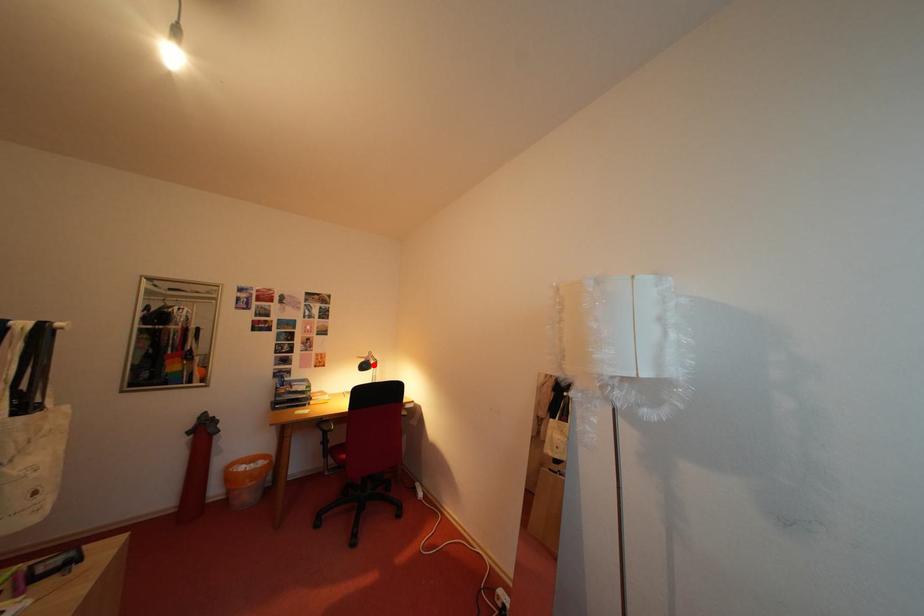
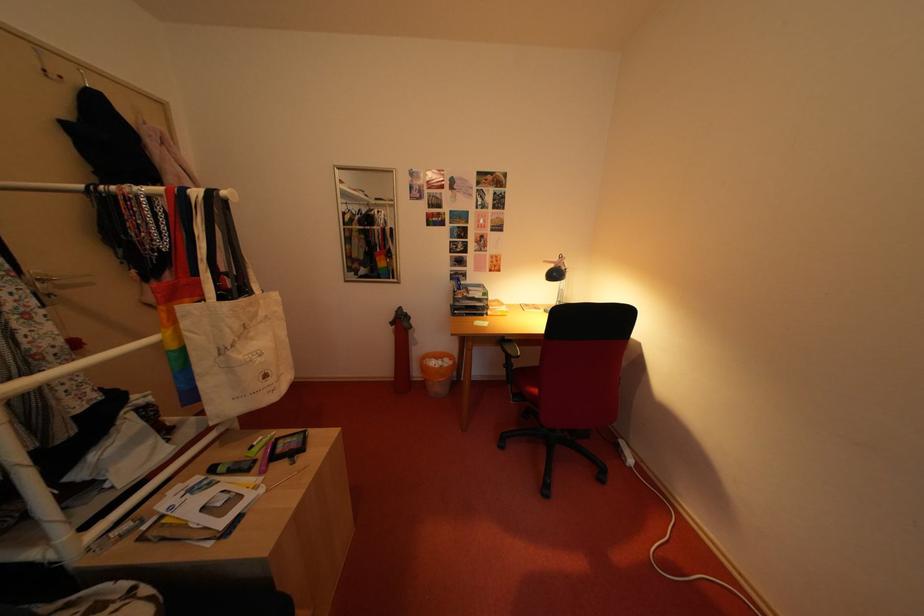
Question: I am providing you with two images of the same scene from different viewpoints. A red point is marked on the first image. Is the red point's position out of view in image 2?

Choices:
 (A) Yes
 (B) No

Answer: (B)